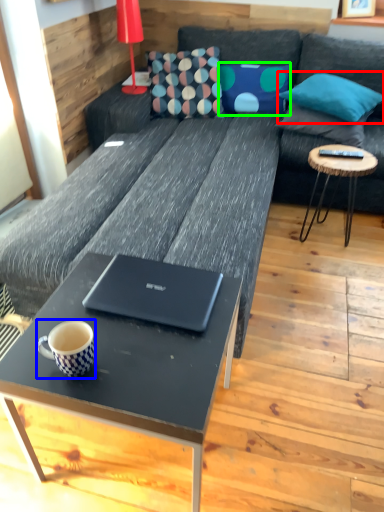
Question: Considering the real-world distances, which object is closest to pillow (highlighted by a red box)? coffee cup (highlighted by a blue box) or pillow (highlighted by a green box).

Choices:
 (A) coffee cup
 (B) pillow

Answer: (B)